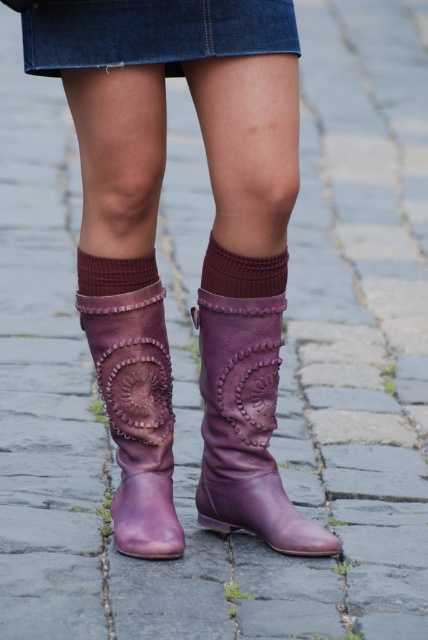
Question: Which object is the closest to the denim skirt at upper center?

Choices:
 (A) smokey brown knit sock at upper center
 (B) maroon knitted sock at center
 (C) purple leather cowboy boot at center

Answer: (B)

Question: Does purple leather boot at lower center have a smaller size compared to smokey brown knit sock at upper center?

Choices:
 (A) yes
 (B) no

Answer: (B)

Question: Can you confirm if purple leather boot at lower center is smaller than maroon knitted sock at center?

Choices:
 (A) no
 (B) yes

Answer: (A)

Question: Estimate the real-world distances between objects in this image. Which object is closer to the purple leather boot at lower center?

Choices:
 (A) denim skirt at upper center
 (B) smokey brown knit sock at upper center

Answer: (B)

Question: Among these points, which one is farthest from the camera?

Choices:
 (A) (252, 362)
 (B) (115, 260)

Answer: (A)

Question: Does denim skirt at upper center appear over maroon knitted sock at center?

Choices:
 (A) yes
 (B) no

Answer: (A)